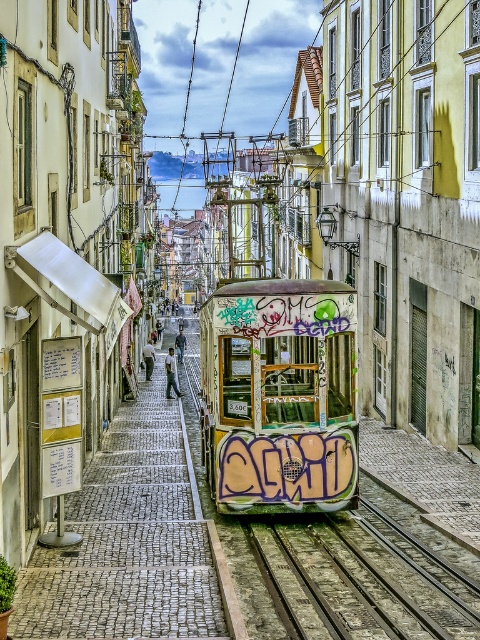
You are a tourist in Lisbon and want to take a photo of the vintage tram. You notice two points marked on the ground where you can stand. One is at point (146,422) and the other at point (274,419). Which point is closer to the tram so you can get a better photo?

Point (274,419) is closer to the tram because it is in front of point (146,422), which is behind it.